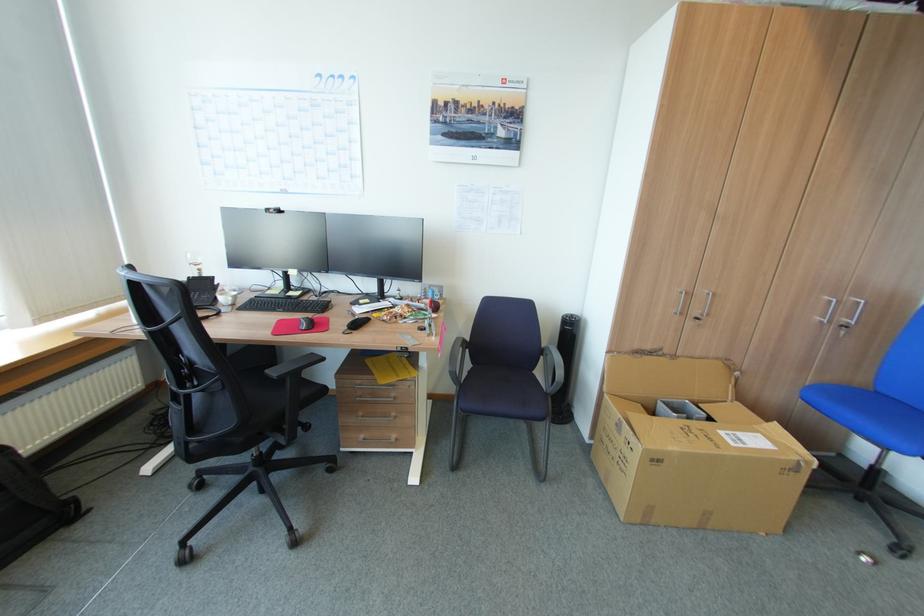
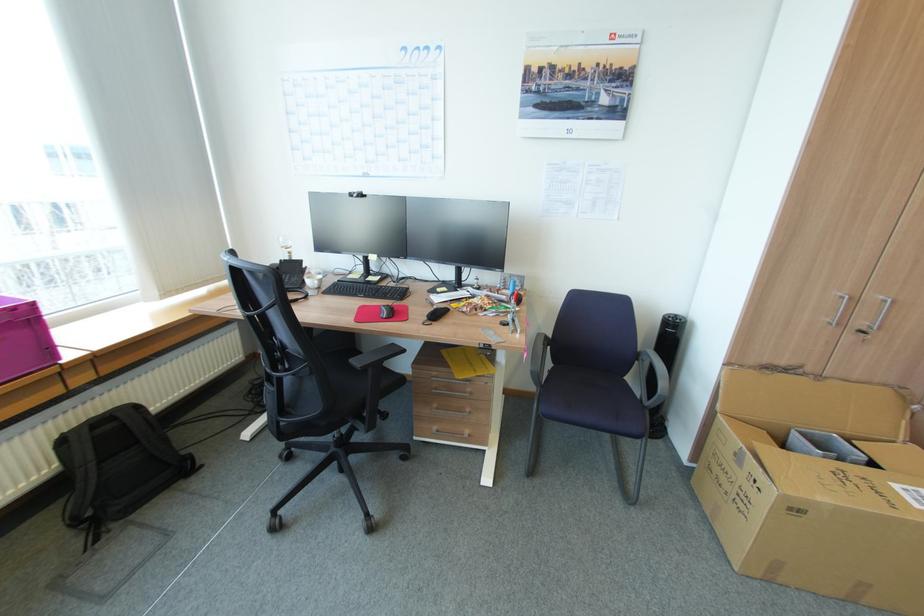
Find the pixel in the second image that matches pixel 477 368 in the first image.

(557, 368)